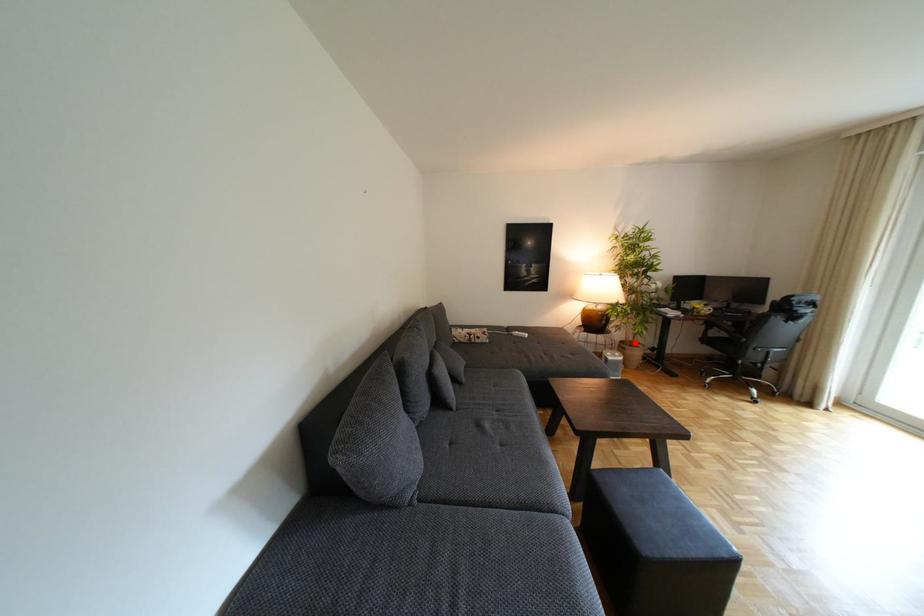
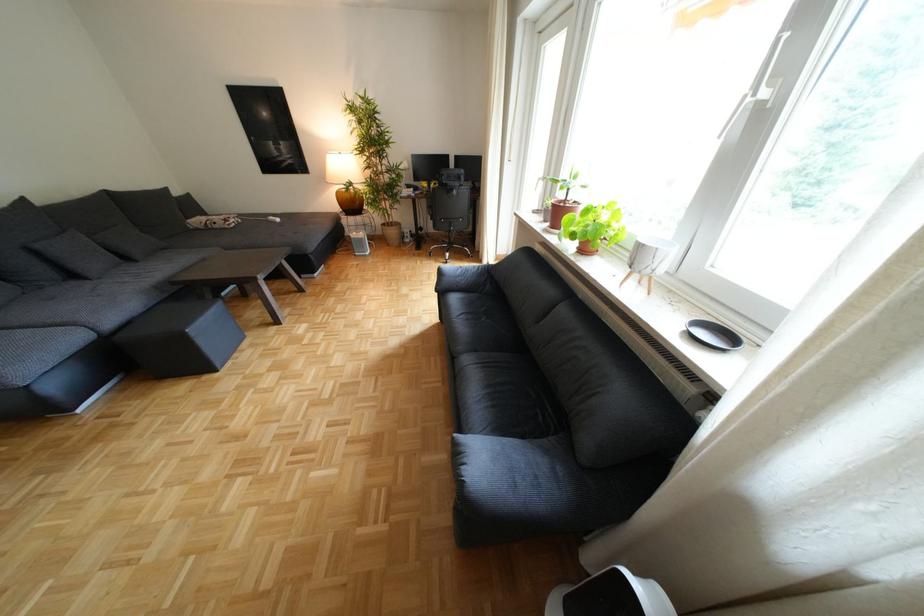
Where in the second image is the point corresponding to the highlighted location from the first image?

(396, 224)